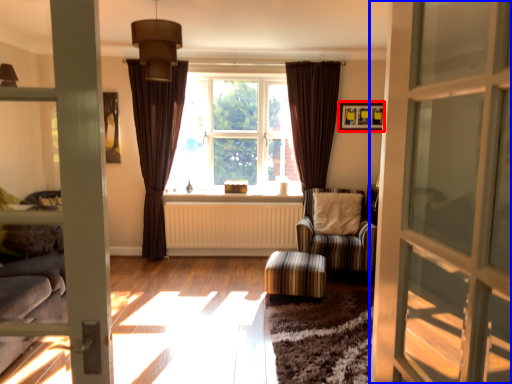
Question: Among these objects, which one is farthest to the camera, picture frame (highlighted by a red box) or door (highlighted by a blue box)?

Choices:
 (A) picture frame
 (B) door

Answer: (A)